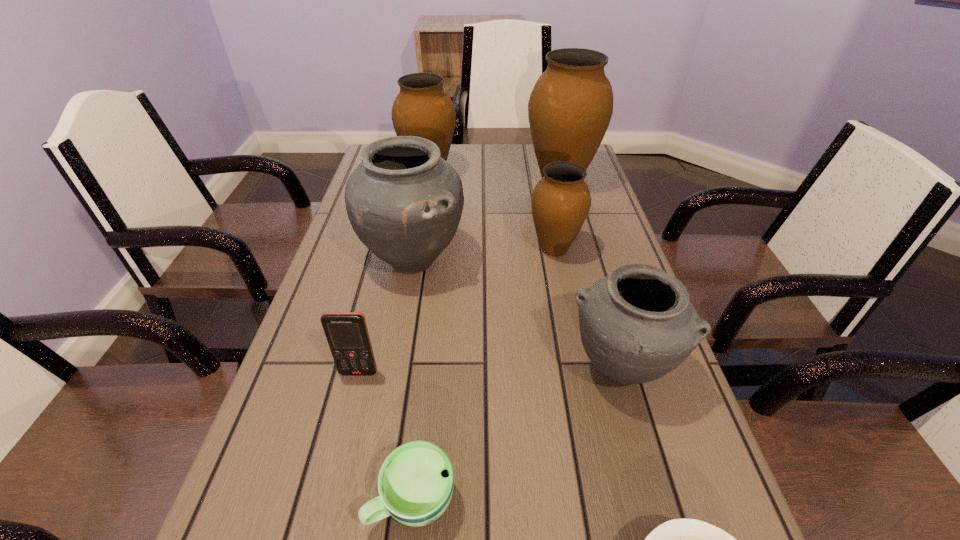
At what (x,y) coordinates should I click in order to perform the action: click on free spot between the second biggest brown urn and the biggest brown urn. Please return your answer as a coordinate pair (x, y). The width and height of the screenshot is (960, 540). Looking at the image, I should click on (494, 179).

Locate an element on the screen. The width and height of the screenshot is (960, 540). vacant space that's between the second shortest object and the orange cellular telephone is located at coordinates (386, 436).

At what (x,y) coordinates should I click in order to perform the action: click on object that stands as the closest to the cellular telephone. Please return your answer as a coordinate pair (x, y). This screenshot has width=960, height=540. Looking at the image, I should click on (415, 483).

This screenshot has width=960, height=540. I want to click on the second closest object to the leftmost brown urn, so click(570, 107).

Identify which urn is the third nearest to the bowl. Please provide its 2D coordinates. Your answer should be formatted as a tuple, i.e. [(x, y)], where the tuple contains the x and y coordinates of a point satisfying the conditions above.

[(561, 200)]

Locate which urn ranks fourth in proximity to the second smallest brown urn. Please provide its 2D coordinates. Your answer should be formatted as a tuple, i.e. [(x, y)], where the tuple contains the x and y coordinates of a point satisfying the conditions above.

[(637, 324)]

You are a GUI agent. You are given a task and a screenshot of the screen. Output one action in this format:
    pyautogui.click(x=<x>, y=<y>)
    Task: Click on the closest brown urn to the second smallest brown urn
    
    Given the screenshot: What is the action you would take?
    pyautogui.click(x=570, y=107)

Point out which brown urn is positioned as the nearest to the second smallest brown urn. Please provide its 2D coordinates. Your answer should be formatted as a tuple, i.e. [(x, y)], where the tuple contains the x and y coordinates of a point satisfying the conditions above.

[(570, 107)]

Where is `vacant space that satisfies the following two spatial constraints: 1. on the back side of the farther black urn; 2. on the left side of the second biggest brown urn`? Image resolution: width=960 pixels, height=540 pixels. vacant space that satisfies the following two spatial constraints: 1. on the back side of the farther black urn; 2. on the left side of the second biggest brown urn is located at coordinates [x=428, y=175].

Identify the location of blank space that satisfies the following two spatial constraints: 1. on the front side of the biggest brown urn; 2. on the right side of the second biggest brown urn. The image size is (960, 540). (427, 183).